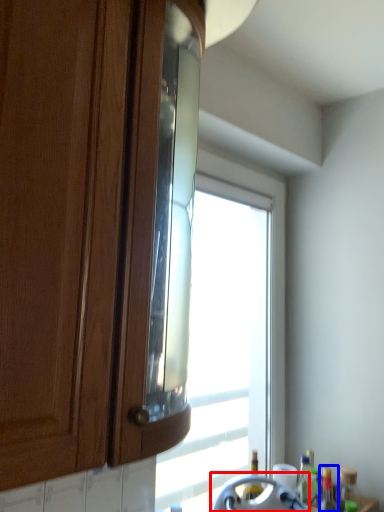
Question: Which point is further to the camera, appliance (highlighted by a red box) or bottle (highlighted by a blue box)?

Choices:
 (A) appliance
 (B) bottle

Answer: (B)